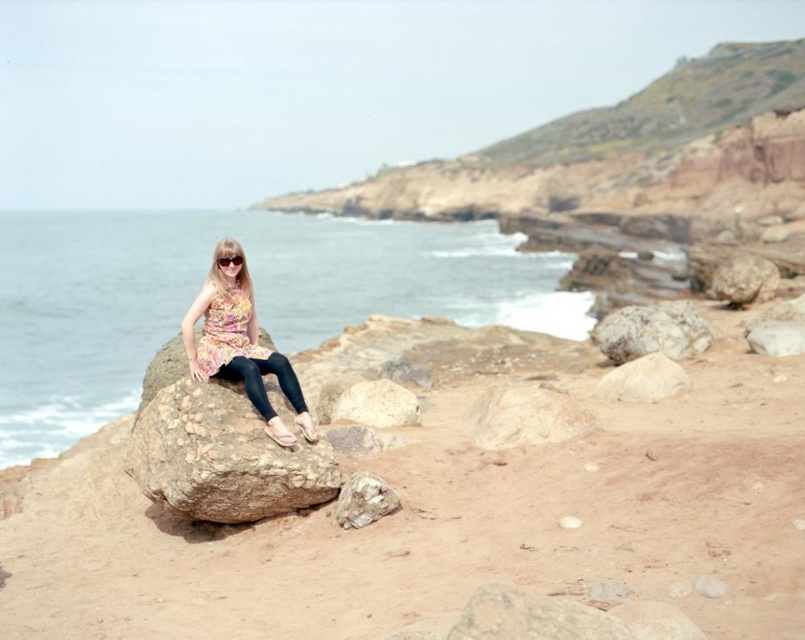
This screenshot has width=805, height=640. I want to click on brown rough rock at center, so point(523,417).

Is point (585, 413) in front of point (387, 508)?

No, (585, 413) is behind (387, 508).

Locate an element on the screen. The image size is (805, 640). brown rough rock at center is located at coordinates (523, 417).

Who is more forward, (642,326) or (225,259)?

Positioned in front is point (225,259).

From the picture: Who is positioned more to the left, smooth gray rock at center-right or black plastic sunglasses at center?

black plastic sunglasses at center

Find the location of a particular element. smooth gray rock at center-right is located at coordinates pos(651,332).

Identify the location of smooth gray rock at center-right. Image resolution: width=805 pixels, height=640 pixels. (651, 332).

Describe the element at coordinates (651, 332) in the screenshot. I see `smooth gray rock at center-right` at that location.

Can you confirm if smooth gray rock at center-right is smaller than white smooth rock at center?

No, smooth gray rock at center-right is not smaller than white smooth rock at center.

Is point (654, 316) more distant than point (380, 397)?

Yes, it is.

You are a GUI agent. You are given a task and a screenshot of the screen. Output one action in this format:
    pyautogui.click(x=<x>, y=<y>)
    Task: Click on the smooth gray rock at center-right
    
    Given the screenshot: What is the action you would take?
    pyautogui.click(x=651, y=332)